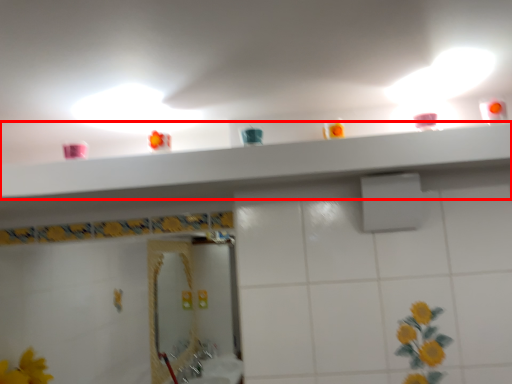
Question: From the image's perspective, what is the correct spatial relationship of shelve (annotated by the red box) in relation to shower?

Choices:
 (A) above
 (B) below

Answer: (A)